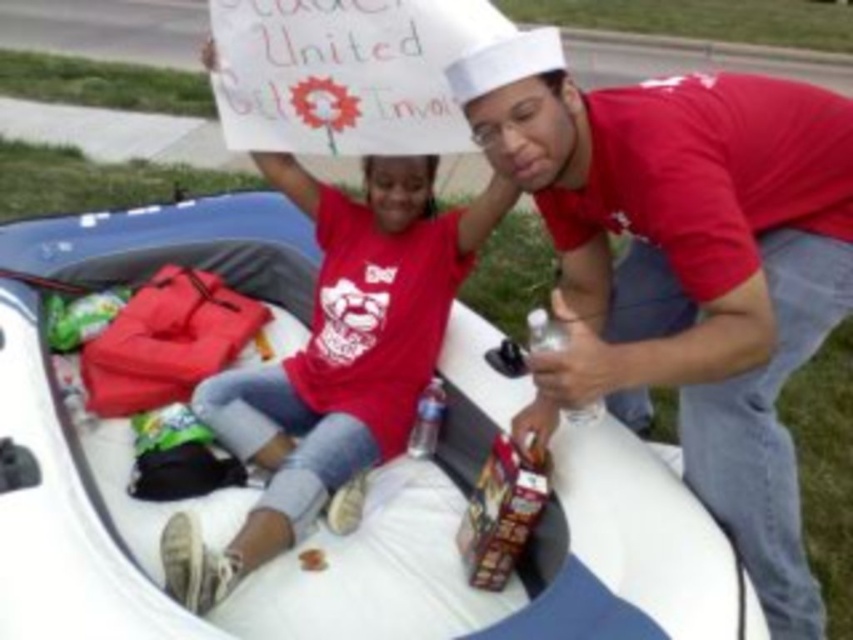
Question: Is matte red t-shirt at center bigger than clear plastic bottle at center?

Choices:
 (A) yes
 (B) no

Answer: (A)

Question: Which point appears closest to the camera in this image?

Choices:
 (A) (538, 348)
 (B) (239, 488)
 (C) (573, 262)
 (D) (416, 179)

Answer: (A)

Question: Which point is farther to the camera?

Choices:
 (A) (276, 541)
 (B) (585, 413)
 (C) (601, 433)
 (D) (791, 348)

Answer: (A)

Question: Considering the real-world distances, which object is closest to the white rubber boat at center?

Choices:
 (A) matte red t-shirt at center
 (B) clear plastic bottle at center

Answer: (A)

Question: Is the position of matte red t-shirt at center more distant than that of clear plastic bottle at center?

Choices:
 (A) no
 (B) yes

Answer: (B)

Question: Can you confirm if white rubber boat at center is wider than clear plastic bottle at center?

Choices:
 (A) no
 (B) yes

Answer: (B)